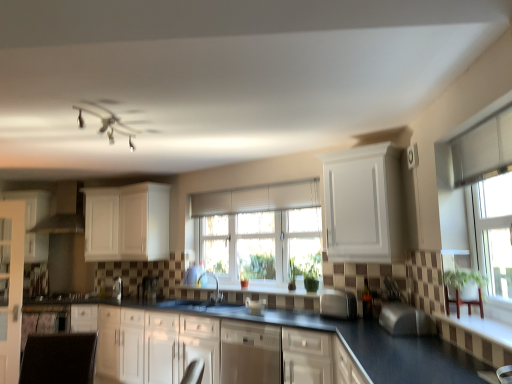
At what (x,y) coordinates should I click in order to perform the action: click on vacant area situated below white pleated blinds at center (from a real-world perspective). Please return your answer as a coordinate pair (x, y). The height and width of the screenshot is (384, 512). Looking at the image, I should click on (250, 292).